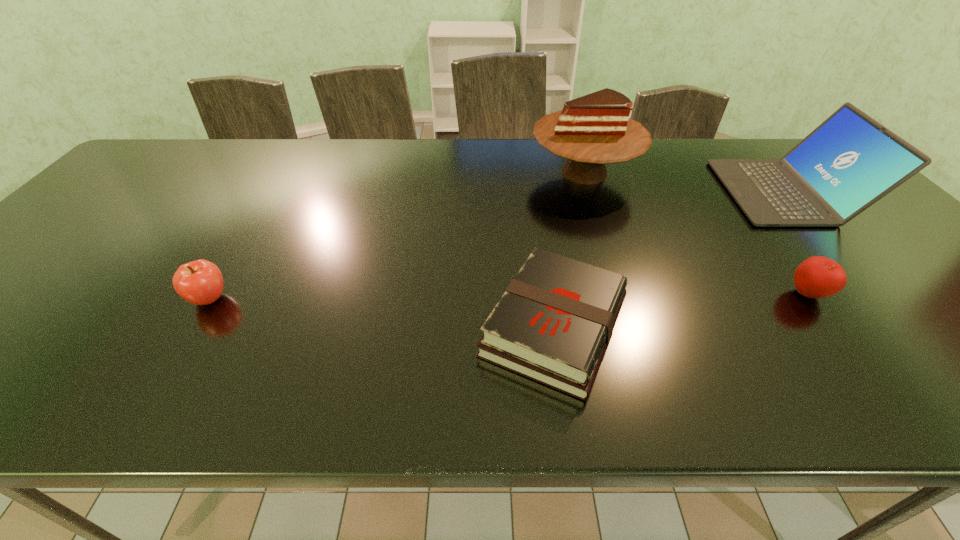
Locate an element on the screen. The height and width of the screenshot is (540, 960). vacant space at the right edge of the desktop is located at coordinates (926, 314).

Where is `vacant region at the far left corner`? vacant region at the far left corner is located at coordinates (180, 140).

The image size is (960, 540). Identify the location of vacant space that is in between the leftmost object and the cake. 396,236.

You are a GUI agent. You are given a task and a screenshot of the screen. Output one action in this format:
    pyautogui.click(x=<x>, y=<y>)
    Task: Click on the vacant area that lies between the leftmost object and the hardback book
    
    Given the screenshot: What is the action you would take?
    pyautogui.click(x=382, y=313)

You are a GUI agent. You are given a task and a screenshot of the screen. Output one action in this format:
    pyautogui.click(x=<x>, y=<y>)
    Task: Click on the vacant space in between the cake and the laptop computer
    This screenshot has width=960, height=540.
    Given the screenshot: What is the action you would take?
    pyautogui.click(x=685, y=183)

Where is `free space between the leftmost object and the laptop computer`? This screenshot has width=960, height=540. free space between the leftmost object and the laptop computer is located at coordinates (497, 246).

I want to click on free area in between the laptop computer and the cake, so click(x=685, y=183).

The width and height of the screenshot is (960, 540). Identify the location of vacant region between the shortest object and the laptop computer. (670, 259).

Identify the location of blank region between the laptop computer and the shorter apple. This screenshot has height=540, width=960. (797, 243).

What are the coordinates of `blank region between the laptop computer and the cake` in the screenshot? It's located at (685, 183).